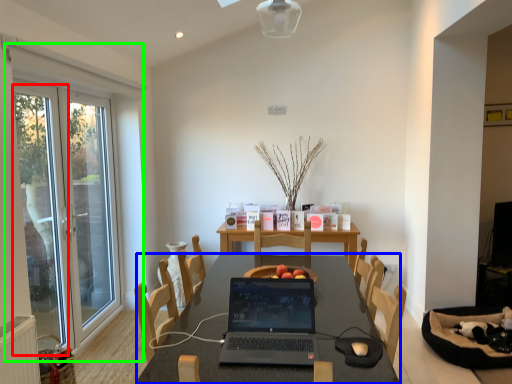
Question: Based on their relative distances, which object is nearer to screen door (highlighted by a red box)? Choose from table (highlighted by a blue box) and window (highlighted by a green box).

Choices:
 (A) table
 (B) window

Answer: (B)